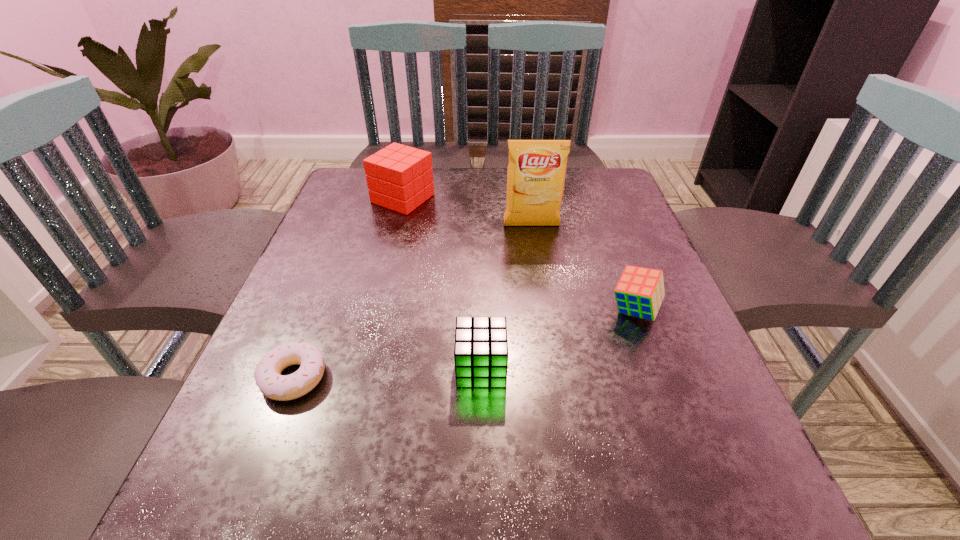
Image resolution: width=960 pixels, height=540 pixels. I want to click on vacant space at the near edge, so click(x=524, y=498).

The width and height of the screenshot is (960, 540). What are the coordinates of `free space at the left edge of the desktop` in the screenshot? It's located at (329, 350).

The height and width of the screenshot is (540, 960). Identify the location of free space at the right edge of the desktop. (603, 257).

You are a GUI agent. You are given a task and a screenshot of the screen. Output one action in this format:
    pyautogui.click(x=<x>, y=<y>)
    Task: Click on the vacant region at the far left corner of the desktop
    This screenshot has width=960, height=540.
    Given the screenshot: What is the action you would take?
    (x=357, y=169)

Find the location of `vacant point at the near right corner`. vacant point at the near right corner is located at coordinates (756, 514).

The height and width of the screenshot is (540, 960). I want to click on empty space between the shortest object and the nearest cube, so click(387, 372).

Find the location of a particular element. vacant area that lies between the third object from left to right and the rightmost object is located at coordinates (558, 339).

The image size is (960, 540). What are the coordinates of `vacant space in between the fourth nearest object and the shortest object` in the screenshot? It's located at (413, 301).

Locate an element on the screen. The height and width of the screenshot is (540, 960). free spot between the third object from left to right and the rightmost cube is located at coordinates (558, 339).

The image size is (960, 540). What are the coordinates of `free space that is in between the doughnut and the nearest cube` in the screenshot? It's located at (387, 372).